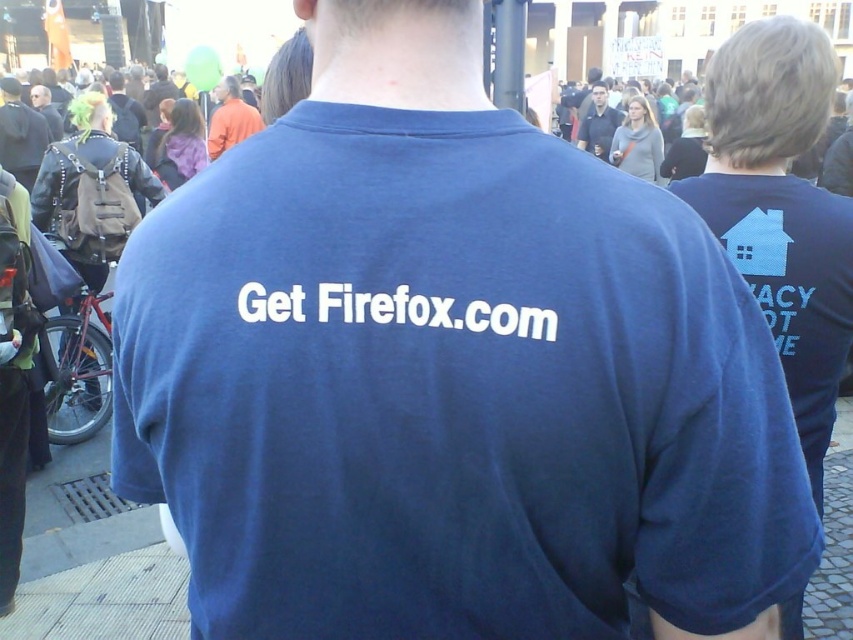
Does orange cotton shirt at upper center have a larger size compared to dark blue shirt at center?

Incorrect, orange cotton shirt at upper center is not larger than dark blue shirt at center.

Is point (219, 129) farther from camera compared to point (602, 90)?

No, (219, 129) is closer to viewer.

Locate an element on the screen. The width and height of the screenshot is (853, 640). orange cotton shirt at upper center is located at coordinates (230, 118).

Is matte black backpack at left thinner than dark blue shirt at center?

No.

Between matte black backpack at left and dark blue shirt at center, which one appears on the left side from the viewer's perspective?

matte black backpack at left is more to the left.

Between point (42, 150) and point (596, 148), which one is positioned behind?

Point (596, 148)

Locate an element on the screen. Image resolution: width=853 pixels, height=640 pixels. matte black backpack at left is located at coordinates tap(20, 134).

Is blue cotton t-shirt at center below orange cotton shirt at upper center?

Yes.

Does point (666, 440) lie behind point (230, 97)?

That is False.

Does point (421, 118) come farther from viewer compared to point (223, 125)?

That is False.

I want to click on blue cotton t-shirt at center, so click(450, 390).